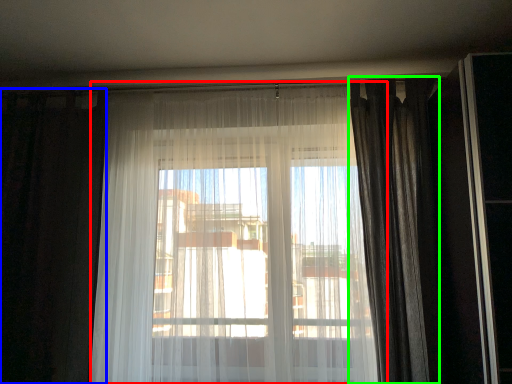
Question: Which object is positioned closest to curtain (highlighted by a red box)? Select from curtain (highlighted by a blue box) and curtain (highlighted by a green box).

Choices:
 (A) curtain
 (B) curtain

Answer: (A)